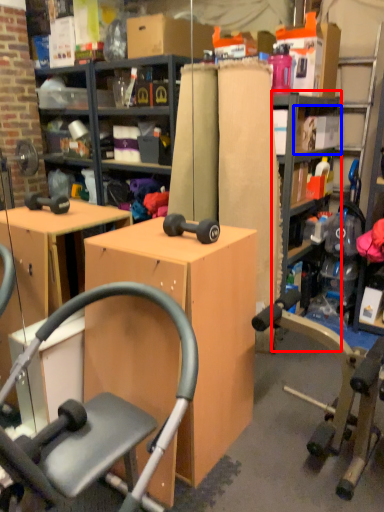
Question: Which of the following is the closest to the observer, bookshelf (highlighted by a red box) or shelf (highlighted by a blue box)?

Choices:
 (A) bookshelf
 (B) shelf

Answer: (A)